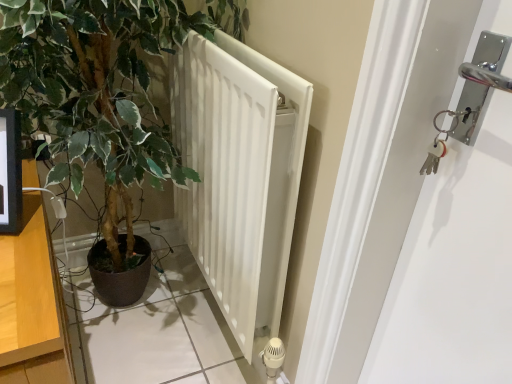
Question: Is green leafy plant at center at the right side of wooden dresser at left?

Choices:
 (A) yes
 (B) no

Answer: (A)

Question: Is green leafy plant at center not close to wooden dresser at left?

Choices:
 (A) no
 (B) yes

Answer: (A)

Question: Considering the relative sizes of green leafy plant at center and wooden dresser at left in the image provided, is green leafy plant at center shorter than wooden dresser at left?

Choices:
 (A) yes
 (B) no

Answer: (B)

Question: Is green leafy plant at center not inside wooden dresser at left?

Choices:
 (A) no
 (B) yes

Answer: (B)

Question: Is green leafy plant at center at the left side of wooden dresser at left?

Choices:
 (A) no
 (B) yes

Answer: (A)

Question: Could you tell me if green leafy plant at center is turned towards wooden dresser at left?

Choices:
 (A) no
 (B) yes

Answer: (B)

Question: Considering the relative sizes of wooden dresser at left and green leafy plant at center in the image provided, is wooden dresser at left taller than green leafy plant at center?

Choices:
 (A) yes
 (B) no

Answer: (B)

Question: From a real-world perspective, is wooden dresser at left on green leafy plant at center?

Choices:
 (A) yes
 (B) no

Answer: (B)

Question: Is green leafy plant at center at the back of wooden dresser at left?

Choices:
 (A) no
 (B) yes

Answer: (B)

Question: Would you consider wooden dresser at left to be distant from green leafy plant at center?

Choices:
 (A) no
 (B) yes

Answer: (A)

Question: Does wooden dresser at left appear on the left side of green leafy plant at center?

Choices:
 (A) no
 (B) yes

Answer: (B)

Question: Is wooden dresser at left further to the viewer compared to green leafy plant at center?

Choices:
 (A) no
 (B) yes

Answer: (A)

Question: Can you confirm if wooden dresser at left is taller than white matte radiator at center?

Choices:
 (A) no
 (B) yes

Answer: (A)